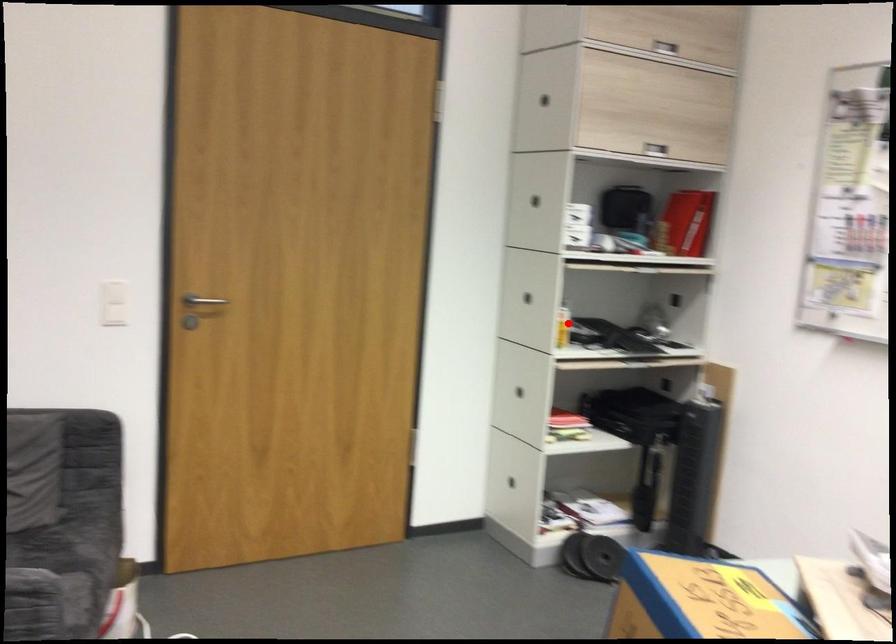
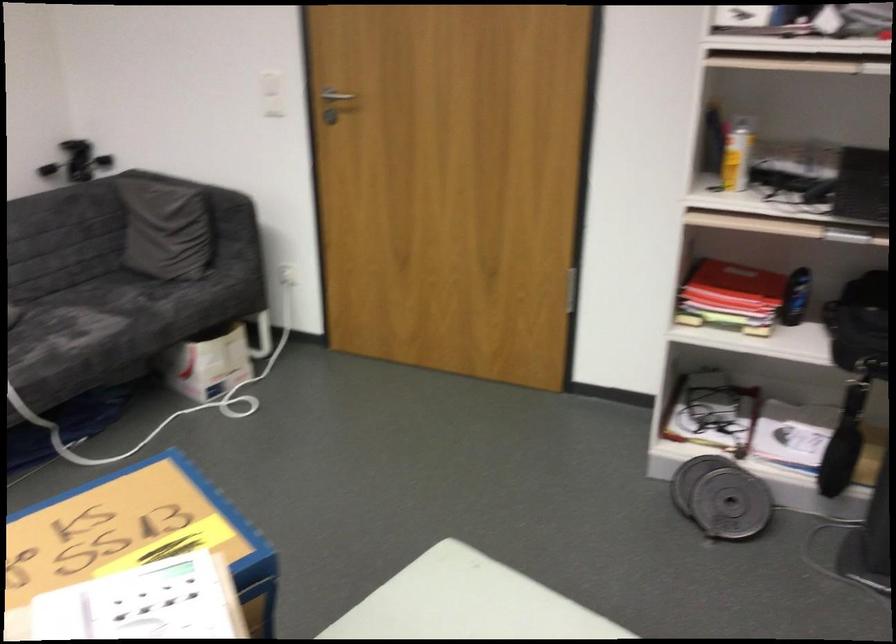
Question: I am providing you with two images of the same scene from different viewpoints. Image1 has a red point marked. In image2, the corresponding 3D location appears at what relative position? Reply with the corresponding letter.

Choices:
 (A) Closer
 (B) Farther

Answer: (A)